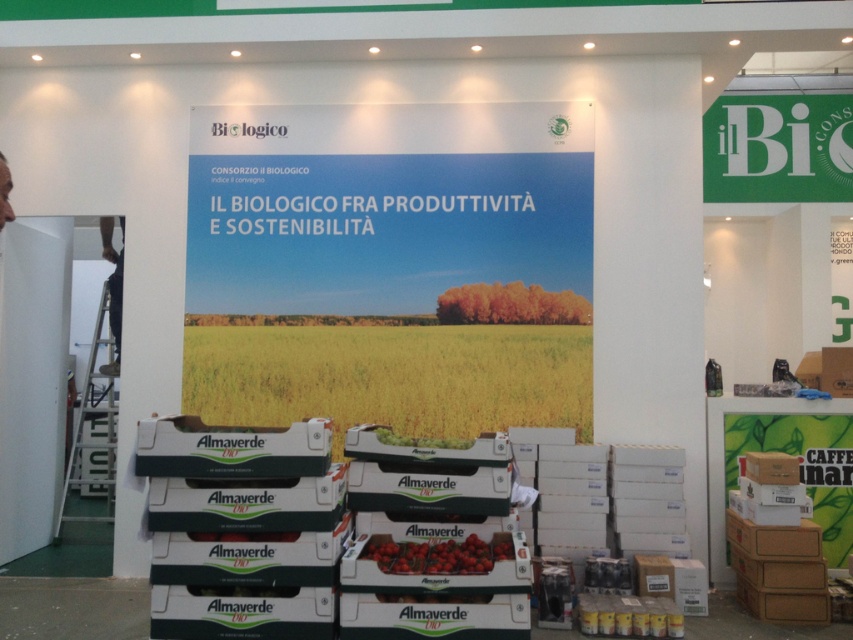
Question: Is red matte tomatoes at center below matte green tomato at center?

Choices:
 (A) no
 (B) yes

Answer: (B)

Question: Can you confirm if red matte tomatoes at center is positioned above matte green tomato at center?

Choices:
 (A) no
 (B) yes

Answer: (A)

Question: Does red matte tomatoes at center come in front of matte green tomato at center?

Choices:
 (A) no
 (B) yes

Answer: (B)

Question: Which point is closer to the camera taking this photo?

Choices:
 (A) (469, 445)
 (B) (383, 556)

Answer: (B)

Question: Which point is farther to the camera?

Choices:
 (A) matte green tomato at center
 (B) red matte tomatoes at center

Answer: (A)